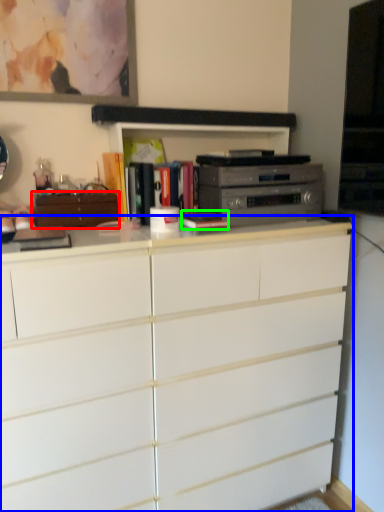
Question: Considering the real-world distances, which object is closest to cabinetry (highlighted by a red box)? chest of drawers (highlighted by a blue box) or book (highlighted by a green box).

Choices:
 (A) chest of drawers
 (B) book

Answer: (B)